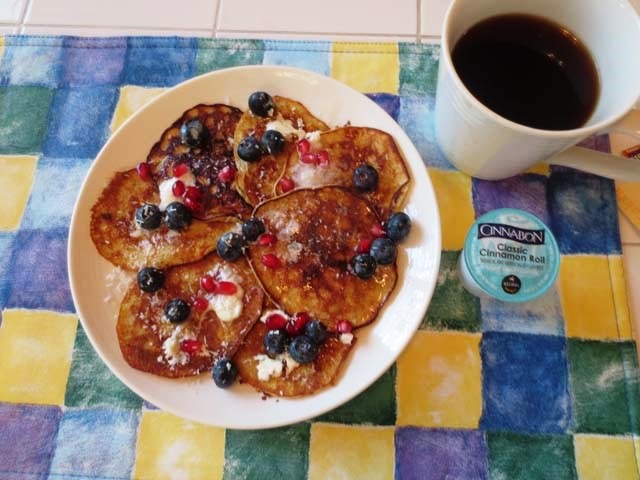
Find the location of a particular element. This screenshot has height=480, width=640. white cup is located at coordinates [592, 24].